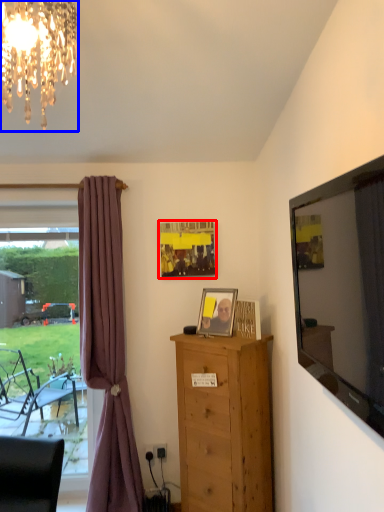
Question: Which of the following is the closest to the observer, picture frame (highlighted by a red box) or lamp (highlighted by a blue box)?

Choices:
 (A) picture frame
 (B) lamp

Answer: (B)